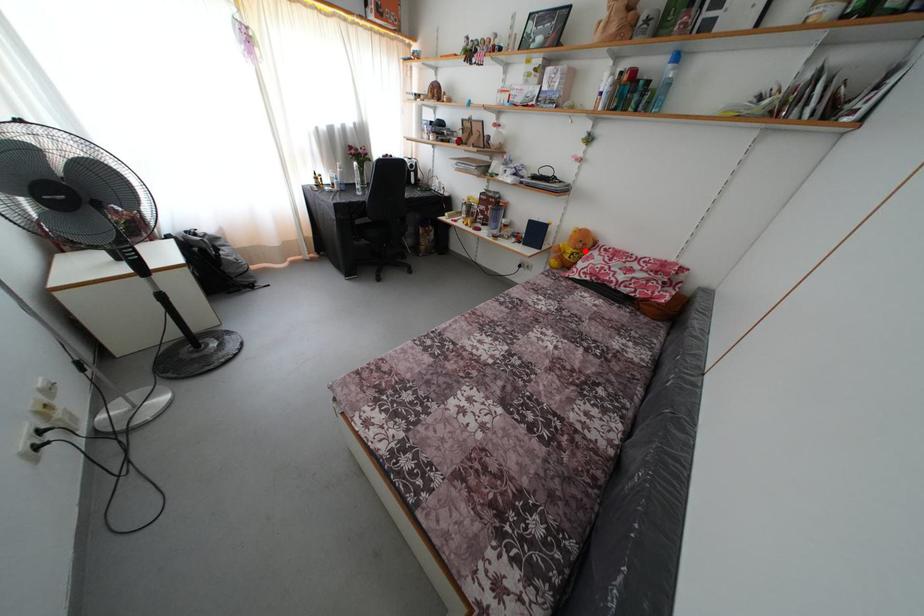
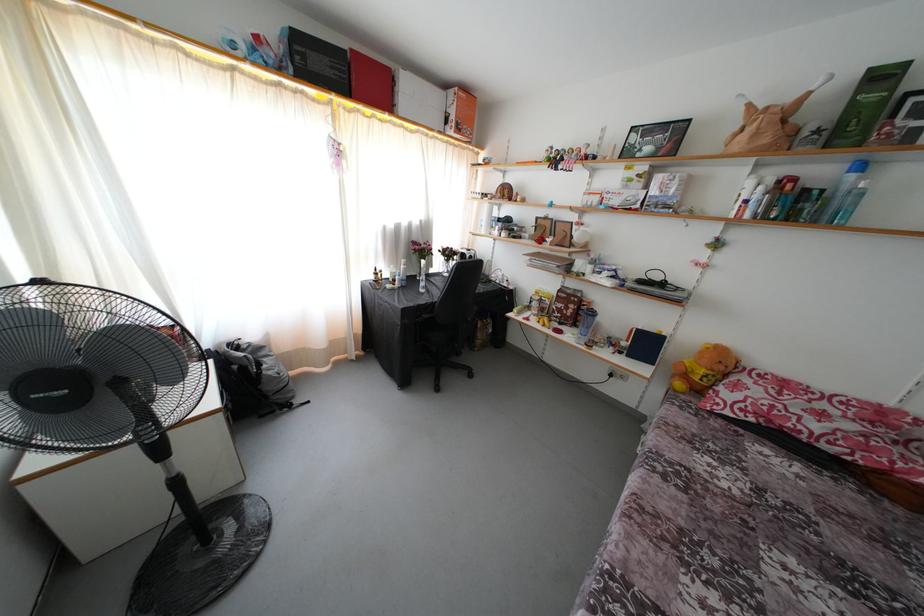
Question: A red point is marked in image1. In image2, is the corresponding 3D point closer to the camera or farther? Reply with the corresponding letter.

Choices:
 (A) The corresponding 3D point is closer.
 (B) The corresponding 3D point is farther.

Answer: (B)